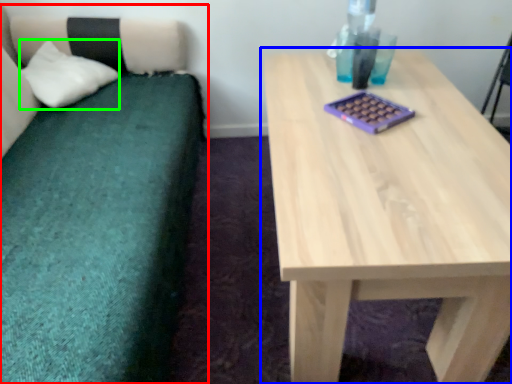
Question: Which is nearer to the studio couch (highlighted by a red box)? table (highlighted by a blue box) or pillow (highlighted by a green box).

Choices:
 (A) table
 (B) pillow

Answer: (B)